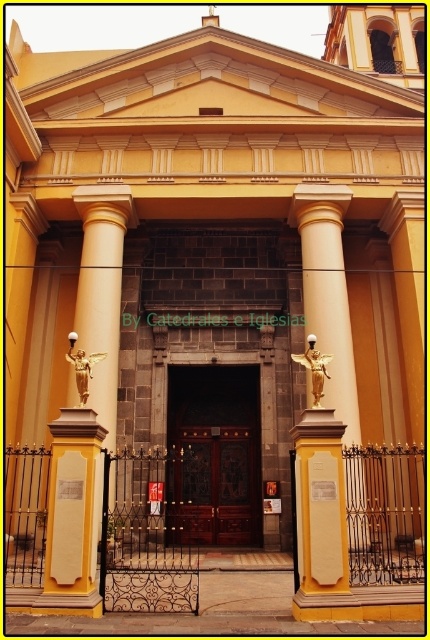
You are standing at the entrance of the grand church and want to take a photo. You notice two points marked on the facade at coordinates point (307,337) and point (70,340). Which point is closer to your camera lens when taking the photo?

Point (70,340) is closer to the camera lens because it is positioned further away from the camera compared to point (307,337), which is closer to the camera.

You are standing at the entrance of the grand church and notice two golden statues. The gold metallic angel at right and the gold metallic statue at center. Which one appears closer to you from your current position?

The gold metallic angel at right is in front of the gold metallic statue at center, so it appears closer to you.